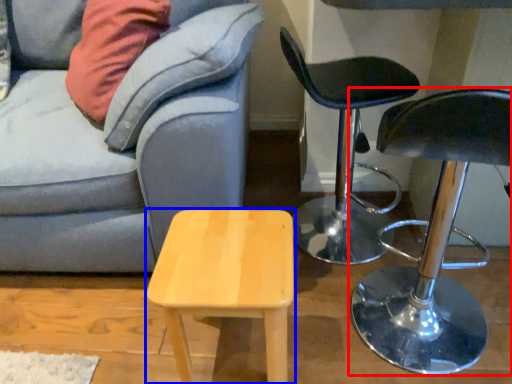
Question: Which object is closer to the camera taking this photo, chair (highlighted by a red box) or stool (highlighted by a blue box)?

Choices:
 (A) chair
 (B) stool

Answer: (A)